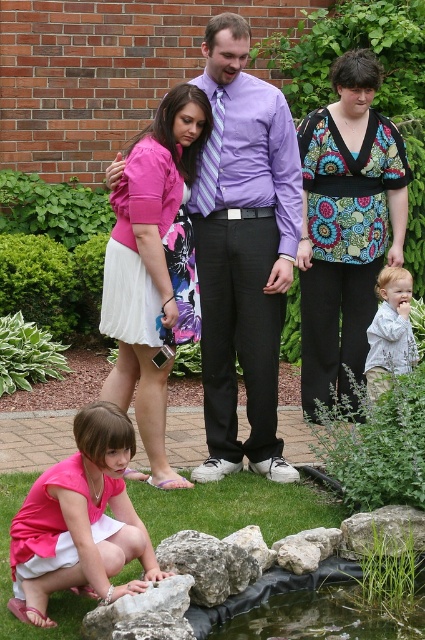
You are a photographer standing at the edge of the pond. You want to take a closeup shot of the gray rough rock at lower center. The camera you have can focus on objects up to 3 meters away. Can you take the photo without moving closer?

The gray rough rock at lower center is 3.76 meters away from the camera. Since the camera can only focus up to 3 meters, you cannot take the closeup shot without moving closer.

You are standing at the point marked by the coordinates point (81,522). What object are you standing on?

The point (81,522) marks the pink matte dress at lower left, so you are standing on the pink matte dress at lower left.

You are a photographer trying to capture a photo of the two adults in the image. The adults are the pink matte dress at lower left and the light gray textured shirt at lower right. Which adult is standing more to the left side of the photo?

The pink matte dress at lower left is positioned on the left side of light gray textured shirt at lower right, so the adult wearing the pink matte dress at lower left is standing more to the left side of the photo.